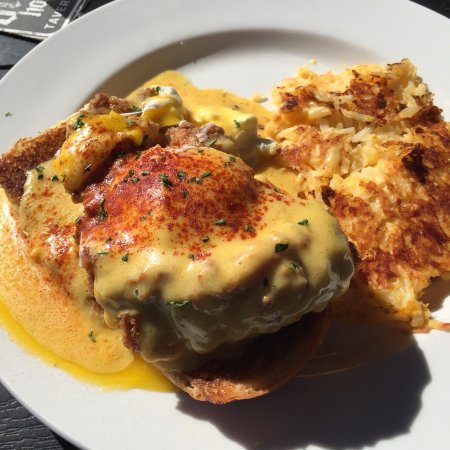
Where is `wooden surface`? This screenshot has height=450, width=450. wooden surface is located at coordinates (22, 427), (440, 5).